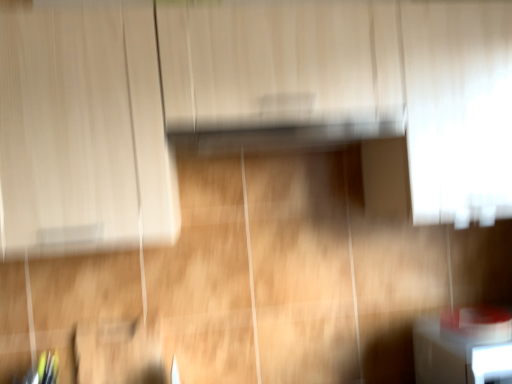
Measure the distance between point (x=449, y=377) and camera.

A distance of 1.12 meters exists between point (x=449, y=377) and camera.

I want to click on white glossy table at lower right, so click(458, 357).

This screenshot has height=384, width=512. What do you see at coordinates (458, 357) in the screenshot?
I see `white glossy table at lower right` at bounding box center [458, 357].

Find the location of a particular element. white glossy table at lower right is located at coordinates (458, 357).